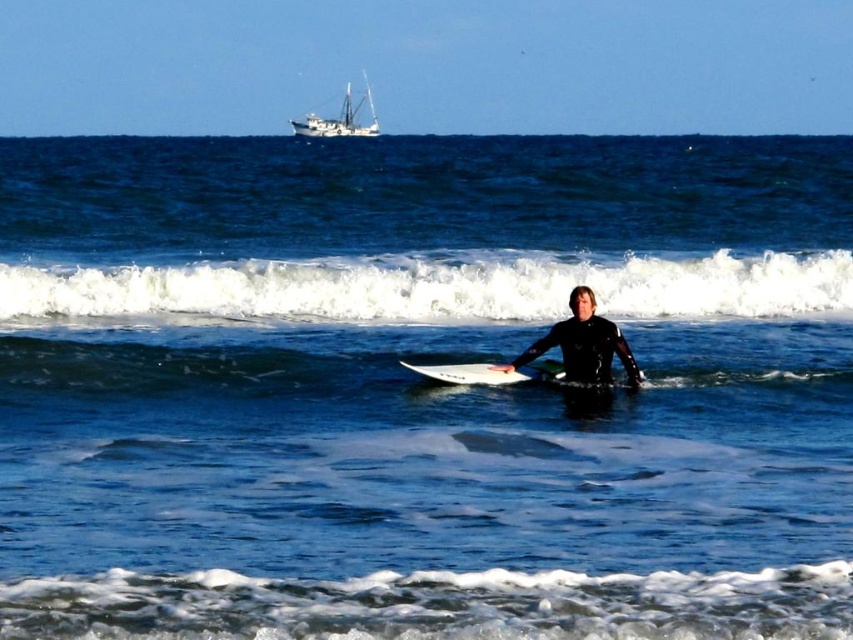
Question: Estimate the real-world distances between objects in this image. Which object is closer to the white glossy surfboard at center?

Choices:
 (A) white foamy wave at center
 (B) white matte boat at upper center

Answer: (A)

Question: Is white glossy surfboard at center wider than white matte boat at upper center?

Choices:
 (A) yes
 (B) no

Answer: (B)

Question: Which point appears farthest from the camera in this image?

Choices:
 (A) (461, 374)
 (B) (335, 132)
 (C) (303, 282)

Answer: (B)

Question: Does white foamy wave at center come behind white glossy surfboard at center?

Choices:
 (A) yes
 (B) no

Answer: (A)

Question: Which point is closer to the camera?

Choices:
 (A) white matte boat at upper center
 (B) white foamy wave at center

Answer: (B)

Question: Does white foamy wave at center have a larger size compared to white glossy surfboard at center?

Choices:
 (A) yes
 (B) no

Answer: (A)